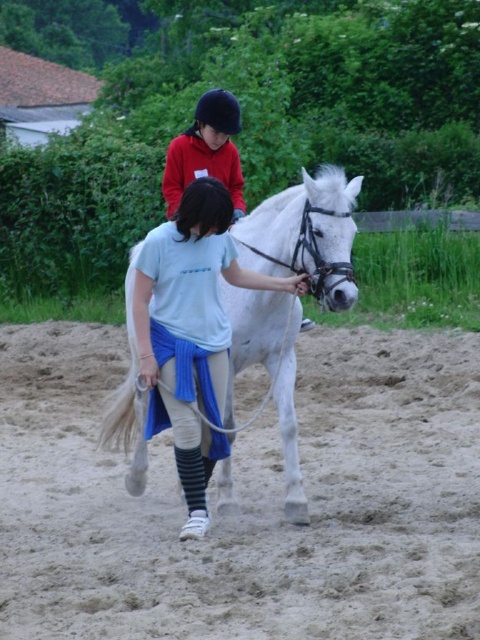
Is point (363, 627) positioned before point (301, 499)?

Yes, point (363, 627) is in front of point (301, 499).

Describe the element at coordinates (247, 499) in the screenshot. This screenshot has height=640, width=480. I see `sandy dirt field at lower center` at that location.

Does point (398, 365) come behind point (307, 232)?

Yes, point (398, 365) is behind point (307, 232).

Find the location of `sandy dirt field at lower center`. sandy dirt field at lower center is located at coordinates (247, 499).

Is white glossy horse at center below matte red jacket at upper center?

Correct, white glossy horse at center is located below matte red jacket at upper center.

In order to click on white glossy horse at center in this screenshot , I will do `click(305, 234)`.

Can you confirm if sandy dirt field at lower center is positioned to the left of matte red jacket at upper center?

No, sandy dirt field at lower center is not to the left of matte red jacket at upper center.

Does sandy dirt field at lower center appear under matte red jacket at upper center?

Yes.

Is point (380, 595) positioned in front of point (189, 172)?

Yes, point (380, 595) is in front of point (189, 172).

This screenshot has width=480, height=640. What are the coordinates of `sandy dirt field at lower center` in the screenshot? It's located at (247, 499).